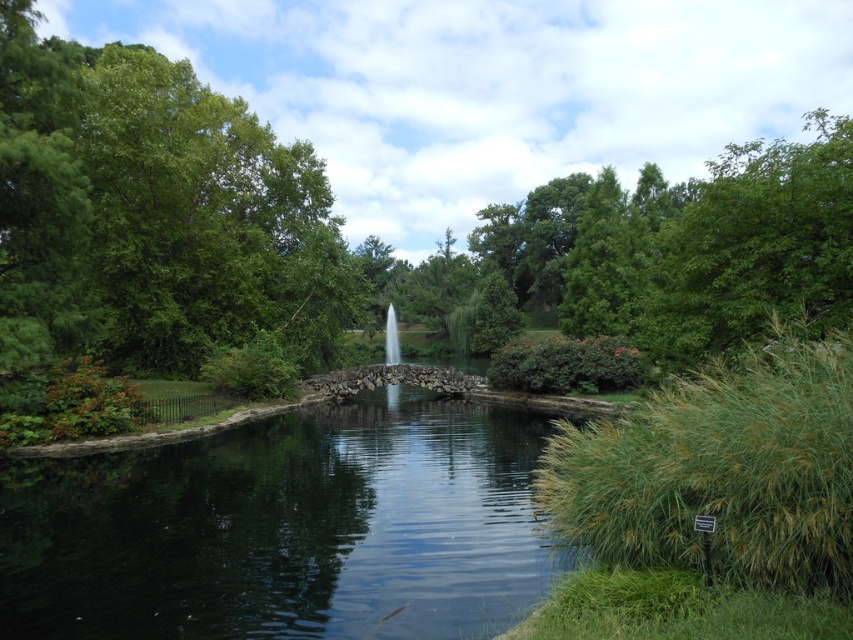
Between green leafy tree at left and white glossy waterfall at center, which one is positioned lower?

white glossy waterfall at center is below.

Can you confirm if green leafy tree at left is shorter than white glossy waterfall at center?

No.

Does point (200, 104) lie in front of point (395, 362)?

Yes, it is in front of point (395, 362).

You are a GUI agent. You are given a task and a screenshot of the screen. Output one action in this format:
    pyautogui.click(x=<x>, y=<y>)
    Task: Click on the green leafy tree at left
    Image resolution: width=853 pixels, height=640 pixels.
    Given the screenshot: What is the action you would take?
    pyautogui.click(x=154, y=214)

Is green leafy tree at left shorter than green leafy tree at upper right?

Yes.

How much distance is there between green leafy tree at left and green leafy tree at upper right?

The distance of green leafy tree at left from green leafy tree at upper right is 30.16 meters.

You are a GUI agent. You are given a task and a screenshot of the screen. Output one action in this format:
    pyautogui.click(x=<x>, y=<y>)
    Task: Click on the green leafy tree at left
    
    Given the screenshot: What is the action you would take?
    pyautogui.click(x=154, y=214)

Image resolution: width=853 pixels, height=640 pixels. I want to click on green leafy tree at left, so click(x=154, y=214).

Is green leafy tree at upper right shorter than white glossy waterfall at center?

No.

Which is behind, point (717, 173) or point (397, 356)?

Positioned behind is point (717, 173).

Find the location of a particular element. The width and height of the screenshot is (853, 640). green leafy tree at upper right is located at coordinates tap(753, 248).